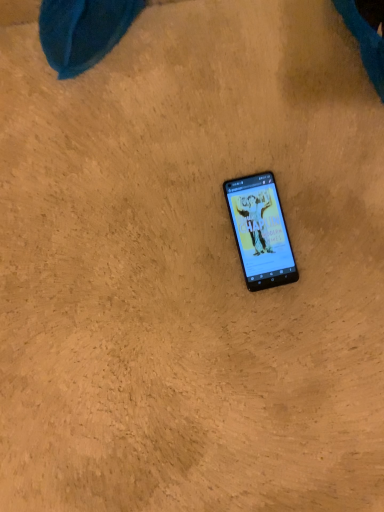
What do you see at coordinates (260, 231) in the screenshot? I see `black glossy mobile phone at center` at bounding box center [260, 231].

Measure the distance between black glossy mobile phone at center and camera.

black glossy mobile phone at center is 59.38 centimeters from camera.

Find the location of a particular element. black glossy mobile phone at center is located at coordinates (260, 231).

Image resolution: width=384 pixels, height=512 pixels. I want to click on black glossy mobile phone at center, so click(x=260, y=231).